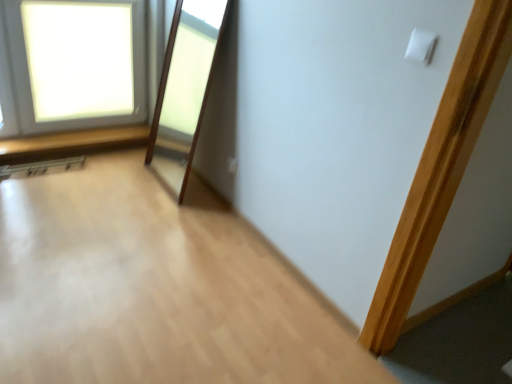
Question: Can you confirm if white matte light switch at upper right is thinner than white frosted glass window at upper left?

Choices:
 (A) yes
 (B) no

Answer: (A)

Question: From a real-world perspective, is white matte light switch at upper right positioned under white frosted glass window at upper left based on gravity?

Choices:
 (A) yes
 (B) no

Answer: (B)

Question: Is white matte light switch at upper right outside of white frosted glass window at upper left?

Choices:
 (A) yes
 (B) no

Answer: (A)

Question: Does white matte light switch at upper right lie behind white frosted glass window at upper left?

Choices:
 (A) yes
 (B) no

Answer: (B)

Question: Is white matte light switch at upper right closer to camera compared to white frosted glass window at upper left?

Choices:
 (A) yes
 (B) no

Answer: (A)

Question: From a real-world perspective, is white matte light switch at upper right on white frosted glass window at upper left?

Choices:
 (A) yes
 (B) no

Answer: (A)

Question: From the image's perspective, is white frosted glass window at upper left on top of white matte light switch at upper right?

Choices:
 (A) yes
 (B) no

Answer: (A)

Question: Is white frosted glass window at upper left to the right of white matte light switch at upper right from the viewer's perspective?

Choices:
 (A) no
 (B) yes

Answer: (A)

Question: Is white frosted glass window at upper left positioned before white matte light switch at upper right?

Choices:
 (A) yes
 (B) no

Answer: (B)

Question: Is white frosted glass window at upper left oriented towards white matte light switch at upper right?

Choices:
 (A) yes
 (B) no

Answer: (A)

Question: Is white frosted glass window at upper left at the left side of white matte light switch at upper right?

Choices:
 (A) no
 (B) yes

Answer: (B)

Question: Is white frosted glass window at upper left outside of white matte light switch at upper right?

Choices:
 (A) yes
 (B) no

Answer: (A)

Question: Would you say white plastic electric outlet at upper center contains white matte light switch at upper right?

Choices:
 (A) no
 (B) yes

Answer: (A)